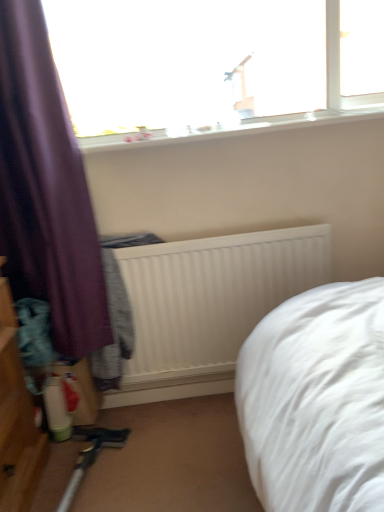
Question: Does white ribbed radiator at center turn towards white smooth window sill at upper center?

Choices:
 (A) no
 (B) yes

Answer: (A)

Question: Does white ribbed radiator at center have a lesser width compared to white smooth window sill at upper center?

Choices:
 (A) yes
 (B) no

Answer: (A)

Question: Is white ribbed radiator at center next to white smooth window sill at upper center?

Choices:
 (A) no
 (B) yes

Answer: (A)

Question: Does white ribbed radiator at center have a greater width compared to white smooth window sill at upper center?

Choices:
 (A) yes
 (B) no

Answer: (B)

Question: Is white ribbed radiator at center shorter than white smooth window sill at upper center?

Choices:
 (A) yes
 (B) no

Answer: (B)

Question: Is white ribbed radiator at center to the left of white smooth window sill at upper center from the viewer's perspective?

Choices:
 (A) yes
 (B) no

Answer: (A)

Question: Is transparent glass window at upper center outside purple fabric curtain at left?

Choices:
 (A) no
 (B) yes

Answer: (B)

Question: Is transparent glass window at upper center not close to purple fabric curtain at left?

Choices:
 (A) no
 (B) yes

Answer: (A)

Question: From the image's perspective, would you say transparent glass window at upper center is shown under purple fabric curtain at left?

Choices:
 (A) yes
 (B) no

Answer: (B)

Question: From the image's perspective, is transparent glass window at upper center on top of purple fabric curtain at left?

Choices:
 (A) no
 (B) yes

Answer: (B)

Question: From a real-world perspective, is transparent glass window at upper center over purple fabric curtain at left?

Choices:
 (A) no
 (B) yes

Answer: (B)

Question: Is transparent glass window at upper center further to the viewer compared to purple fabric curtain at left?

Choices:
 (A) yes
 (B) no

Answer: (A)

Question: Can you confirm if white smooth window sill at upper center is thinner than transparent glass window at upper center?

Choices:
 (A) no
 (B) yes

Answer: (A)